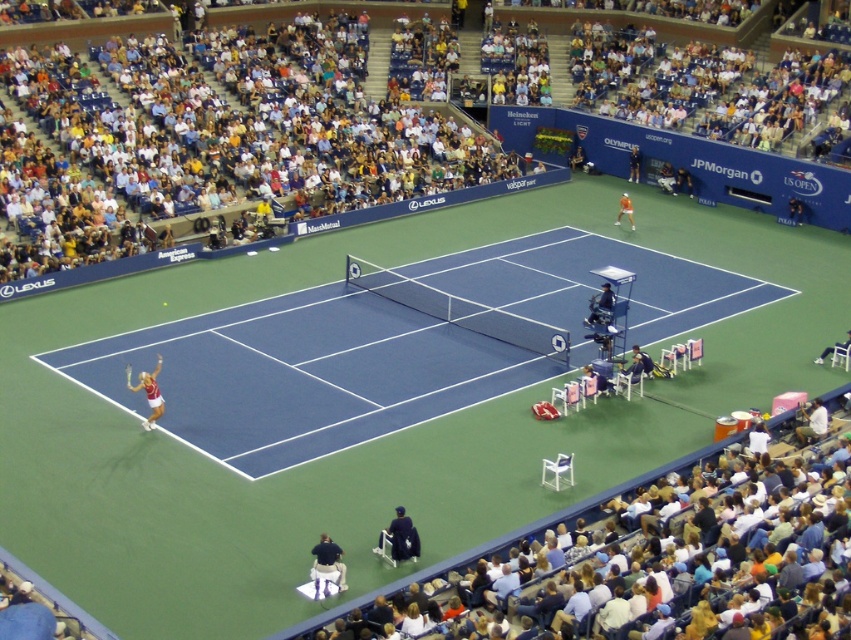
Question: Considering the real-world distances, which object is closest to the white tennis racket at upper right?

Choices:
 (A) blue synthetic turf at lower left
 (B) orange fabric chair at upper right
 (C) dark blue fabric chair at center
 (D) white plastic chair at lower right

Answer: (B)

Question: Among these points, which one is farthest from the camera?

Choices:
 (A) (661, 172)
 (B) (126, 372)
 (C) (311, 397)

Answer: (A)

Question: Which point appears closest to the camera in this image?

Choices:
 (A) (143, 428)
 (B) (643, 541)
 (C) (343, 589)
 (D) (383, 531)

Answer: (B)

Question: Does orange fabric chair at upper right have a smaller size compared to white matte tennis racket at left?

Choices:
 (A) yes
 (B) no

Answer: (B)

Question: Is white plastic chair at lower right smaller than dark blue fabric chair at lower center?

Choices:
 (A) yes
 (B) no

Answer: (A)

Question: Is dark blue fabric chair at lower center bigger than orange shirt at upper right?

Choices:
 (A) yes
 (B) no

Answer: (B)